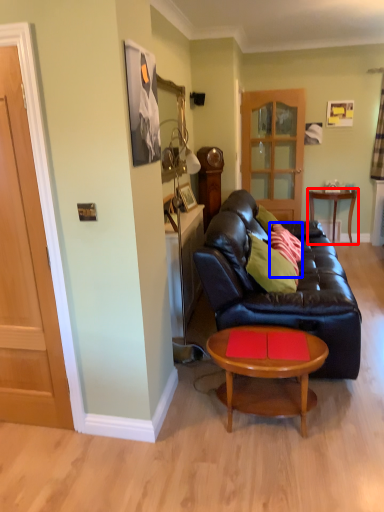
Question: Which point is further to the camera, table (highlighted by a red box) or pillow (highlighted by a blue box)?

Choices:
 (A) table
 (B) pillow

Answer: (A)